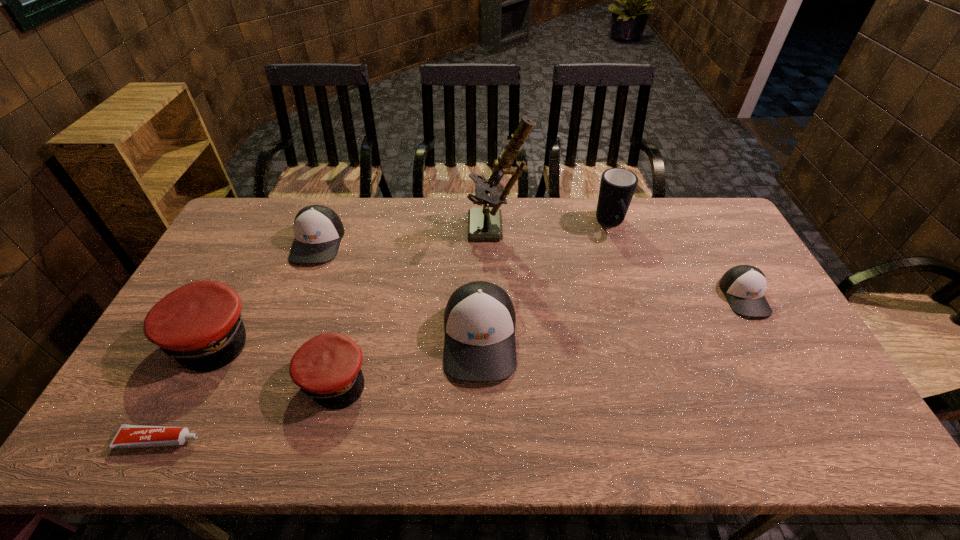
Find the location of a particular element. vacant area situated on the front panel of the third tallest object is located at coordinates (480, 422).

The image size is (960, 540). What are the coordinates of `vacant space located on the front panel of the third object from left to right` in the screenshot? It's located at coord(298,294).

This screenshot has height=540, width=960. Identify the location of vacant space located at the front of the left red cap where the visor is located. (307, 336).

Where is `free region located on the front panel of the rightmost object`? This screenshot has width=960, height=540. free region located on the front panel of the rightmost object is located at coordinates (827, 444).

This screenshot has width=960, height=540. In order to click on vacant space located at the front of the third cap from right to left where the visor is located in this screenshot , I will do `click(493, 378)`.

The width and height of the screenshot is (960, 540). In order to click on vacant space located at the nozzle of the toothpaste in this screenshot , I will do [311, 440].

Identify the location of microscope that is at the far edge. (484, 224).

This screenshot has width=960, height=540. In order to click on mug that is positioned at the far edge in this screenshot , I will do `click(617, 187)`.

Locate an element on the screen. cap located at the far edge is located at coordinates (318, 230).

Where is `object that is positioned at the near edge`? Image resolution: width=960 pixels, height=540 pixels. object that is positioned at the near edge is located at coordinates (127, 436).